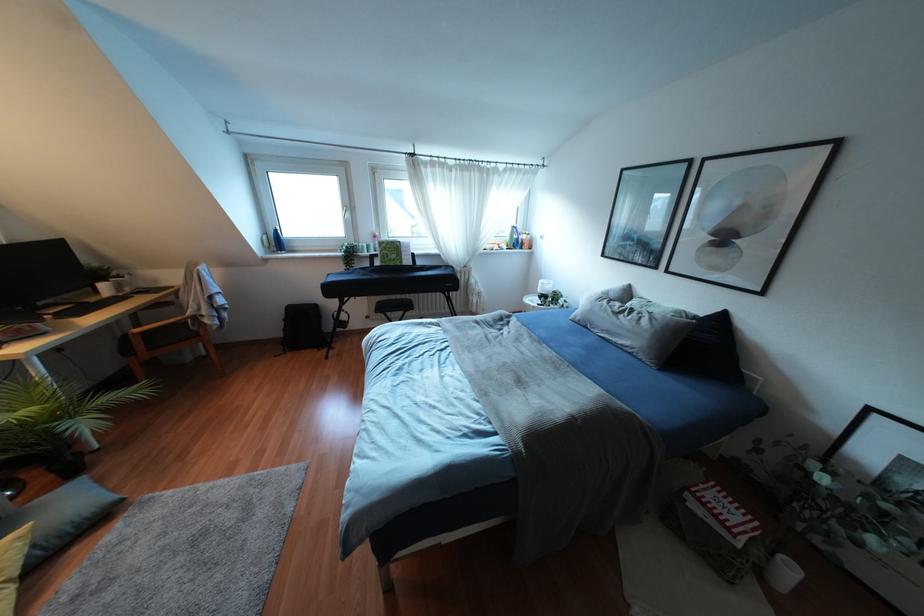
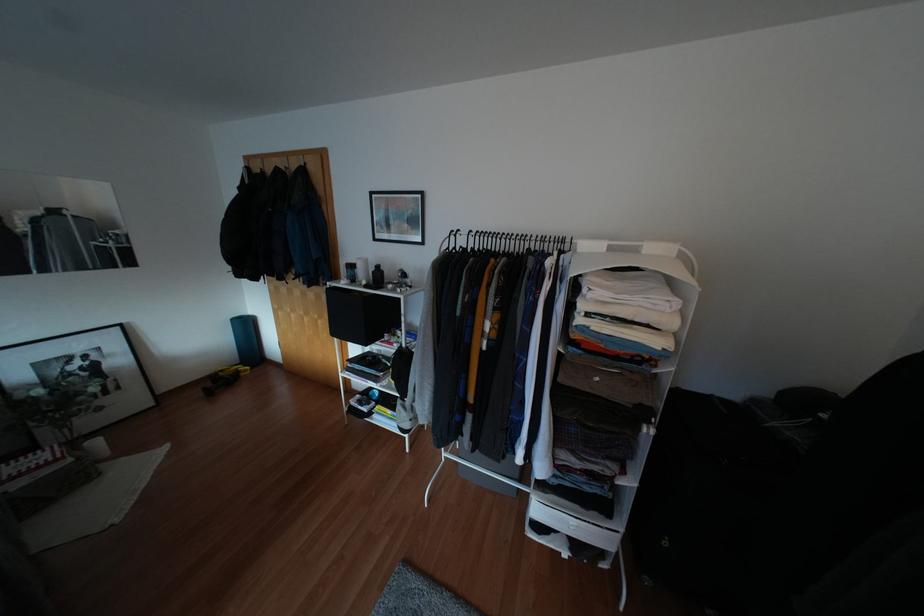
Where in the second image is the point corresponding to point 791,570 from the first image?

(94, 442)